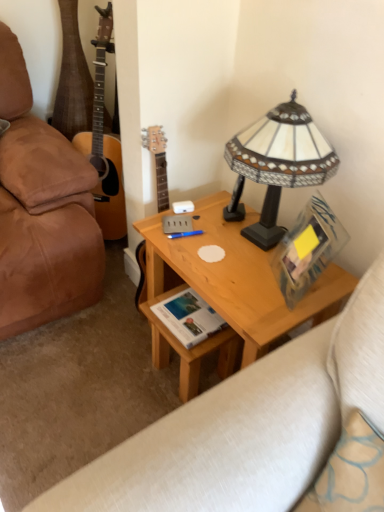
Where is `vacant space situated on the left part of blue plastic pen at center`? vacant space situated on the left part of blue plastic pen at center is located at coordinates (164, 228).